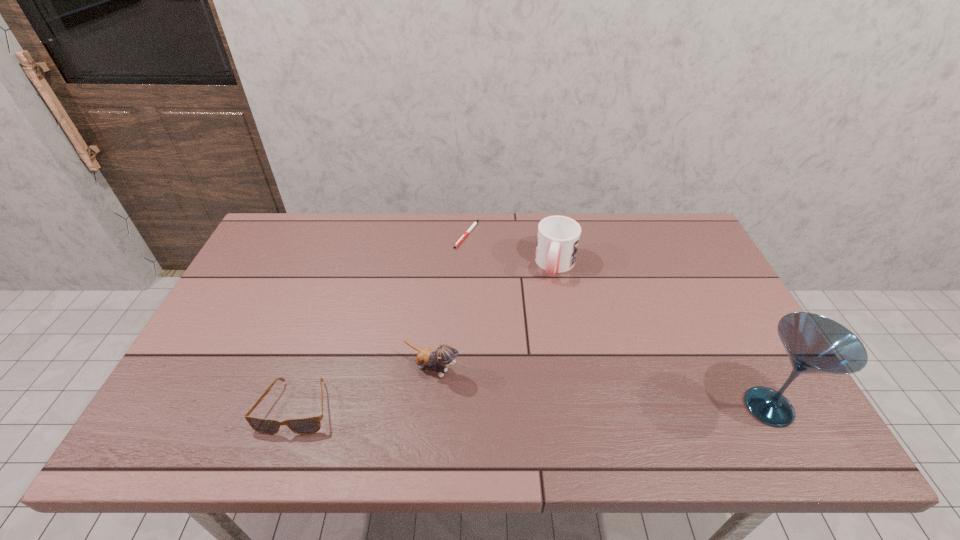
Locate an element on the screen. The width and height of the screenshot is (960, 540). martini at the near edge is located at coordinates (815, 344).

You are a GUI agent. You are given a task and a screenshot of the screen. Output one action in this format:
    pyautogui.click(x=<x>, y=<y>)
    Task: Click on the kitten that is at the near edge
    This screenshot has width=960, height=540.
    Given the screenshot: What is the action you would take?
    pyautogui.click(x=444, y=356)

Where is `object located in the right edge section of the desktop`? Image resolution: width=960 pixels, height=540 pixels. object located in the right edge section of the desktop is located at coordinates (815, 344).

You are a GUI agent. You are given a task and a screenshot of the screen. Output one action in this format:
    pyautogui.click(x=<x>, y=<y>)
    Task: Click on the object positioned at the near right corner
    This screenshot has height=540, width=960.
    Given the screenshot: What is the action you would take?
    pyautogui.click(x=815, y=344)

In the image, there is a desktop. In order to click on vacant space at the far edge in this screenshot , I will do `click(507, 234)`.

Locate an element on the screen. vacant area at the near edge is located at coordinates (426, 388).

Find the location of `free space at the left edge of the desktop`. free space at the left edge of the desktop is located at coordinates (263, 302).

Find the location of `vacant space at the far left corner of the desktop`. vacant space at the far left corner of the desktop is located at coordinates (307, 248).

Locate an element on the screen. This screenshot has height=540, width=960. free space at the far right corner is located at coordinates (663, 228).

Find the location of a particular element. vacant region at the near right corner of the desktop is located at coordinates (730, 386).